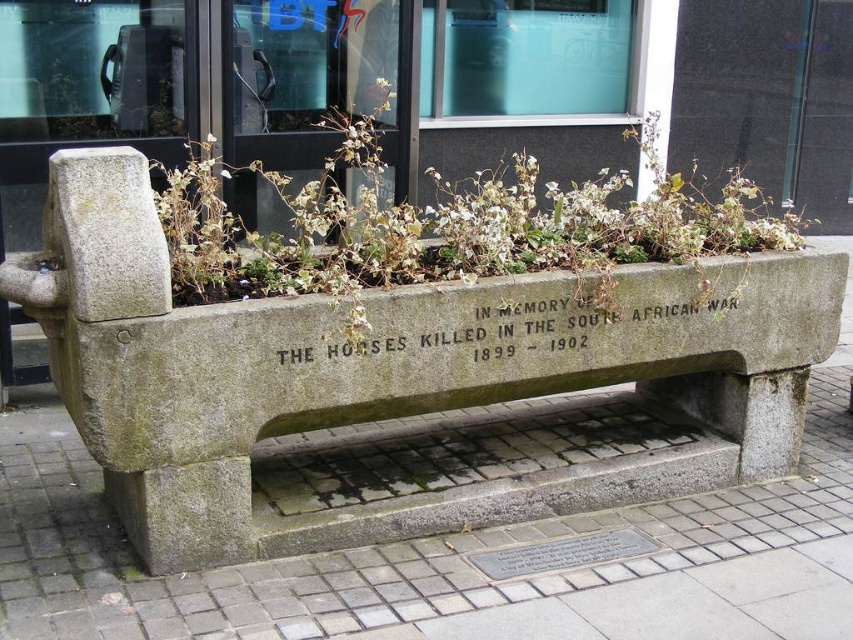
You are a city planner assessing the space around the gray concrete bench at lower center and the black stone engraving at center. You need to install a new small flower pot that must be placed between them. Considering their sizes, which object should the flower pot be closer to?

The gray concrete bench at lower center is wider than the black stone engraving at center. Therefore, the flower pot should be placed closer to the black stone engraving at center to ensure adequate space between the two objects.

You are standing in front of the gray stone bench at center and want to sit on the gray concrete bench at lower center. Can you walk directly forward to reach it?

The gray concrete bench at lower center is behind the gray stone bench at center, so you cannot walk directly forward to reach it. You need to move sideways or around the gray stone bench at center.